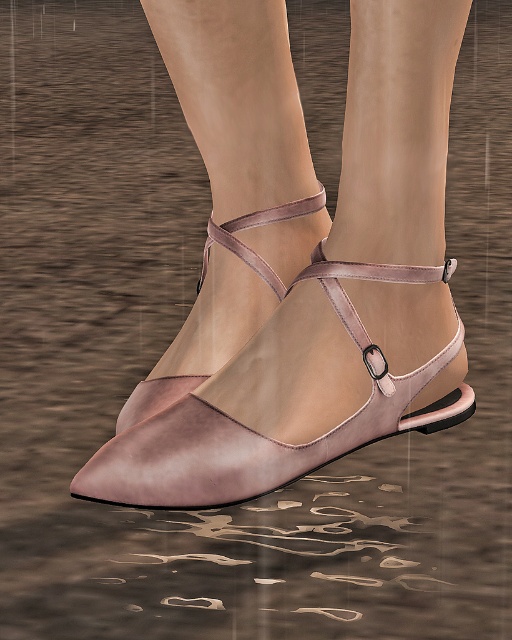
Is matte leather sandal at center to the left of matte pink leather strap at center from the viewer's perspective?

No, matte leather sandal at center is not to the left of matte pink leather strap at center.

Is matte leather sandal at center wider than matte pink leather strap at center?

Yes.

Locate an element on the screen. matte leather sandal at center is located at coordinates (258, 433).

What are the coordinates of `matte leather sandal at center` in the screenshot? It's located at (258, 433).

Based on the photo, can you confirm if matte pink leather shoe at center is shorter than matte pink leather strap at center?

In fact, matte pink leather shoe at center may be taller than matte pink leather strap at center.

Can you confirm if matte pink leather shoe at center is positioned below matte pink leather strap at center?

Indeed, matte pink leather shoe at center is positioned under matte pink leather strap at center.

The height and width of the screenshot is (640, 512). What do you see at coordinates (257, 227) in the screenshot? I see `matte pink leather shoe at center` at bounding box center [257, 227].

Find the location of a particular element. The width and height of the screenshot is (512, 640). matte pink leather shoe at center is located at coordinates coord(257,227).

Does matte leather sandal at center have a greater height compared to matte pink leather shoe at center?

No, matte leather sandal at center is not taller than matte pink leather shoe at center.

Who is higher up, matte leather sandal at center or matte pink leather shoe at center?

Positioned higher is matte pink leather shoe at center.

Who is more distant from viewer, (132, 394) or (287, 204)?

Positioned behind is point (287, 204).

Locate an element on the screen. matte leather sandal at center is located at coordinates (258, 433).